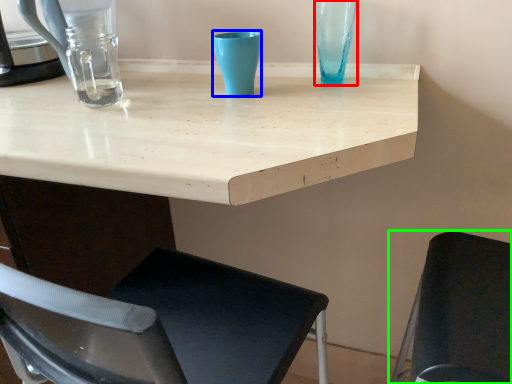
Question: Which is nearer to the glass vase (highlighted by a red box)? turquoise (highlighted by a blue box) or chair (highlighted by a green box).

Choices:
 (A) turquoise
 (B) chair

Answer: (A)